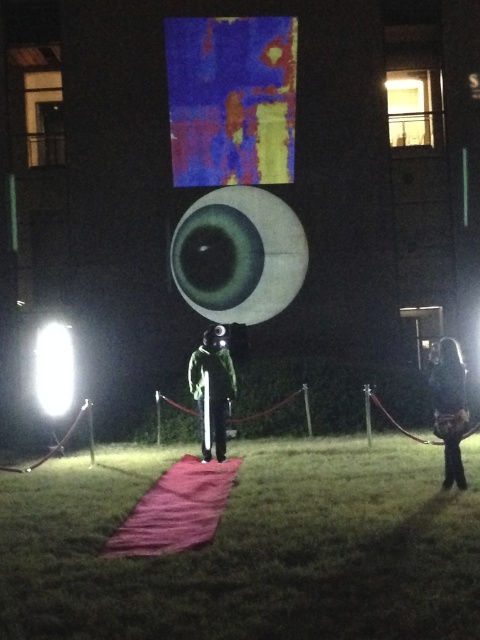
Question: Does green fabric suit at center lie behind white glossy light at left?

Choices:
 (A) yes
 (B) no

Answer: (B)

Question: Estimate the real-world distances between objects in this image. Which object is farther from the dark fabric coat at lower right?

Choices:
 (A) white glossy light at left
 (B) green fabric suit at center

Answer: (A)

Question: Which object is farther from the camera taking this photo?

Choices:
 (A) dark fabric coat at lower right
 (B) white glossy light at left
 (C) green grass at center
 (D) green fabric suit at center

Answer: (B)

Question: Can you confirm if green grass at center is positioned above dark fabric coat at lower right?

Choices:
 (A) no
 (B) yes

Answer: (A)

Question: Which of the following is the farthest from the observer?

Choices:
 (A) white glossy light at left
 (B) dark fabric coat at lower right
 (C) green grass at center
 (D) green fabric suit at center

Answer: (A)

Question: Is green grass at center thinner than green fabric suit at center?

Choices:
 (A) no
 (B) yes

Answer: (A)